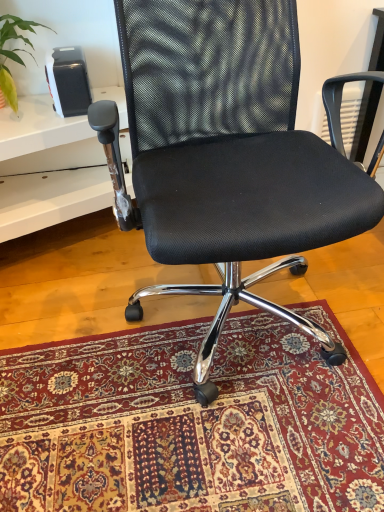
Question: From a real-world perspective, is green leafy plant at upper left positioned above or below black mesh office chair at center?

Choices:
 (A) above
 (B) below

Answer: (A)

Question: Looking at their shapes, would you say green leafy plant at upper left is wider or thinner than black mesh office chair at center?

Choices:
 (A) wide
 (B) thin

Answer: (B)

Question: Estimate the real-world distances between objects in this image. Which object is farther from the white plastic table at left?

Choices:
 (A) black mesh office chair at center
 (B) green leafy plant at upper left
 (C) carpeted rug at center

Answer: (C)

Question: Considering the real-world distances, which object is farthest from the white plastic table at left?

Choices:
 (A) carpeted rug at center
 (B) green leafy plant at upper left
 (C) black mesh office chair at center

Answer: (A)